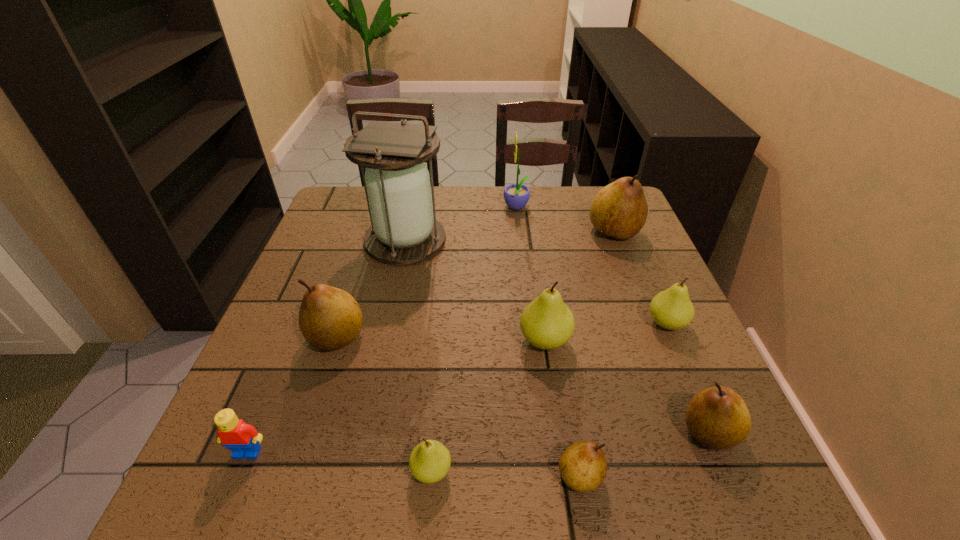
Locate an element on the screen. This screenshot has width=960, height=540. the sixth pear from right to left is located at coordinates (429, 462).

Locate an element on the screen. Image resolution: width=960 pixels, height=540 pixels. the nearest green pear is located at coordinates (429, 462).

What are the coordinates of `the smallest brown pear` in the screenshot? It's located at (583, 466).

In order to click on free point located 0.190m on the back of the tallest object in this screenshot , I will do `click(418, 186)`.

Identify the location of free region located on the front-facing side of the sunflower. The image size is (960, 540). (386, 208).

I want to click on vacant space situated on the front-facing side of the sunflower, so click(403, 208).

Where is `vacant space located on the front-facing side of the sunflower`? This screenshot has width=960, height=540. vacant space located on the front-facing side of the sunflower is located at coordinates (413, 208).

Locate an element on the screen. vacant space located on the front of the farthest pear is located at coordinates (652, 328).

Find the location of a particular element. This screenshot has height=540, width=960. vacant area located 0.050m on the right of the leftmost brown pear is located at coordinates (390, 338).

This screenshot has width=960, height=540. What are the coordinates of `free space located on the right of the biggest green pear` in the screenshot? It's located at (652, 340).